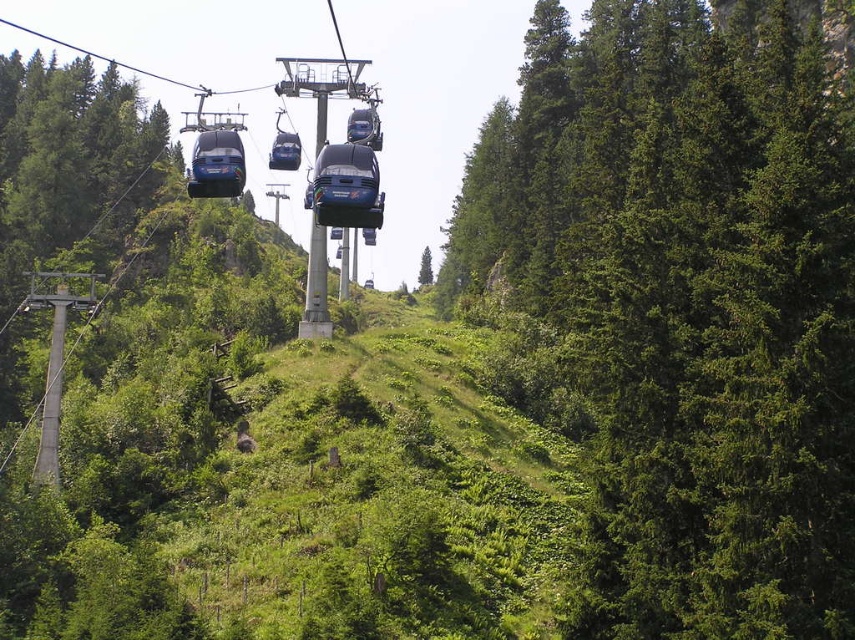
Between green matte tree at right and matte blue cable car at upper center, which one is positioned lower?

matte blue cable car at upper center

Image resolution: width=855 pixels, height=640 pixels. What are the coordinates of `green matte tree at right` in the screenshot? It's located at (680, 307).

Is point (354, 195) farther from viewer compared to point (282, 132)?

No, (354, 195) is in front of (282, 132).

Does point (332, 205) come in front of point (286, 140)?

Yes, it is in front of point (286, 140).

Where is `blue metallic cable car at center`? The width and height of the screenshot is (855, 640). blue metallic cable car at center is located at coordinates (345, 188).

Can you confirm if green matte tree at right is smaller than green matte tree at center?

Incorrect, green matte tree at right is not smaller in size than green matte tree at center.

Between green matte tree at right and green matte tree at center, which one appears on the right side from the viewer's perspective?

green matte tree at right

Locate an element on the screen. Image resolution: width=855 pixels, height=640 pixels. green matte tree at right is located at coordinates (680, 307).